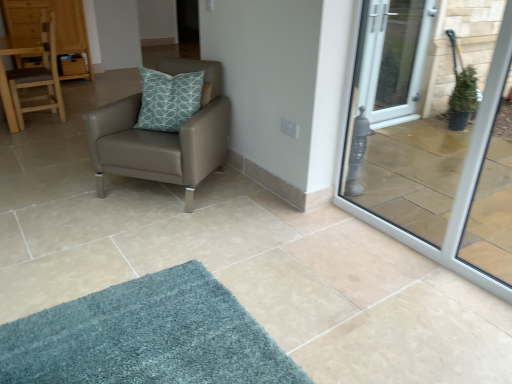
Question: In terms of size, does transparent glass door at right appear bigger or smaller than light brown wooden chair at left, the 1th chair positioned from the back?

Choices:
 (A) big
 (B) small

Answer: (B)

Question: From a real-world perspective, relative to light brown wooden chair at left, positioned as the second chair in front-to-back order, is transparent glass door at right vertically above or below?

Choices:
 (A) below
 (B) above

Answer: (B)

Question: Which is nearer to the matte brown leather chair at center, the 1th chair from the right?

Choices:
 (A) light brown wooden chair at left, the 1th chair positioned from the back
 (B) wooden dresser at upper left
 (C) wooden drawer at upper left
 (D) transparent glass door at right

Answer: (D)

Question: Which of these objects is positioned closest to the wooden dresser at upper left?

Choices:
 (A) matte brown leather chair at center, positioned as the first chair in front-to-back order
 (B) wooden drawer at upper left
 (C) transparent glass door at right
 (D) light brown wooden chair at left, the 1th chair positioned from the back

Answer: (B)